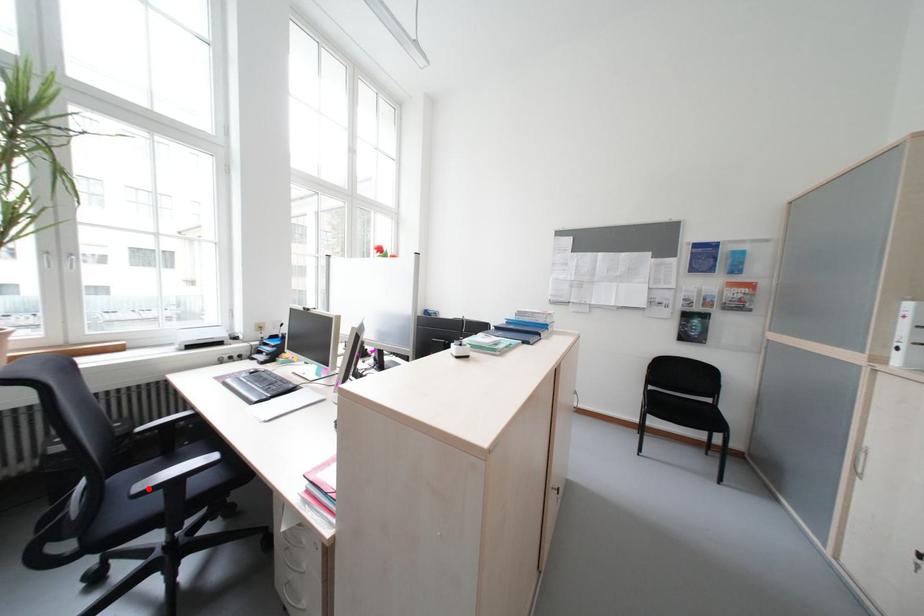
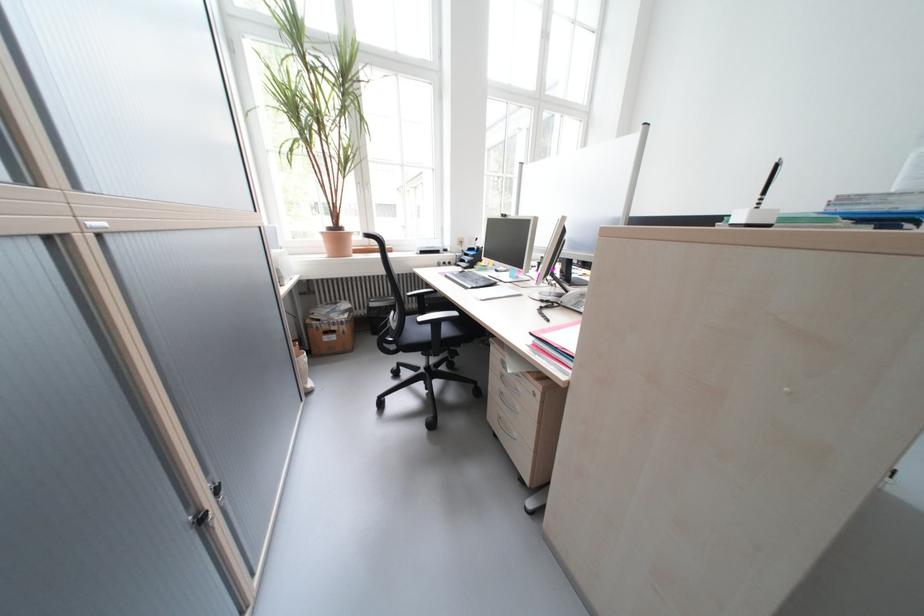
Where in the second image is the point corresponding to the highlighted location from the first image?

(431, 320)